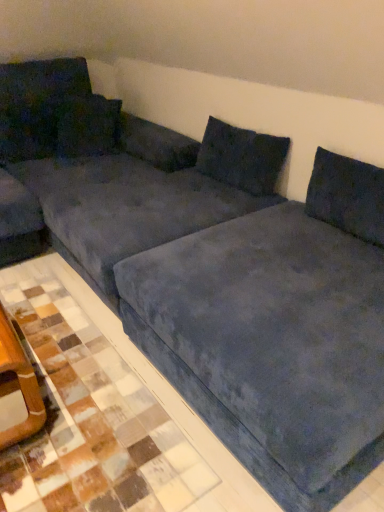
Question: From the image's perspective, would you say blue suede tile at lower right is positioned over velvet dark blue pillow at upper left, which is the second pillow in left-to-right order?

Choices:
 (A) yes
 (B) no

Answer: (B)

Question: From a real-world perspective, is blue suede tile at lower right physically above velvet dark blue pillow at upper left, arranged as the second pillow when viewed from the right?

Choices:
 (A) no
 (B) yes

Answer: (A)

Question: Does blue suede tile at lower right have a greater height compared to velvet dark blue pillow at upper left, arranged as the second pillow when viewed from the right?

Choices:
 (A) yes
 (B) no

Answer: (B)

Question: Is blue suede tile at lower right facing towards velvet dark blue pillow at upper left, arranged as the second pillow when viewed from the right?

Choices:
 (A) no
 (B) yes

Answer: (A)

Question: Does blue suede tile at lower right have a lesser width compared to velvet dark blue pillow at upper left, arranged as the second pillow when viewed from the right?

Choices:
 (A) no
 (B) yes

Answer: (A)

Question: Does blue suede tile at lower right have a greater width compared to velvet dark blue pillow at upper left, arranged as the second pillow when viewed from the right?

Choices:
 (A) no
 (B) yes

Answer: (B)

Question: From a real-world perspective, is velvet dark blue pillow at upper center, positioned as the 1th pillow in right-to-left order, on velvet blue couch at center?

Choices:
 (A) no
 (B) yes

Answer: (B)

Question: From a real-world perspective, is velvet dark blue pillow at upper center, the third pillow when ordered from left to right, under velvet blue couch at center?

Choices:
 (A) no
 (B) yes

Answer: (A)

Question: Does velvet dark blue pillow at upper center, the third pillow when ordered from left to right, have a lesser width compared to velvet blue couch at center?

Choices:
 (A) yes
 (B) no

Answer: (A)

Question: Is velvet dark blue pillow at upper center, positioned as the 1th pillow in right-to-left order, outside velvet blue couch at center?

Choices:
 (A) no
 (B) yes

Answer: (B)

Question: Can you confirm if velvet dark blue pillow at upper center, positioned as the 1th pillow in right-to-left order, is smaller than velvet blue couch at center?

Choices:
 (A) no
 (B) yes

Answer: (B)

Question: Is velvet dark blue pillow at upper center, positioned as the 1th pillow in right-to-left order, next to velvet blue couch at center and touching it?

Choices:
 (A) no
 (B) yes

Answer: (A)

Question: Is velvet dark blue pillow at upper left, arranged as the second pillow when viewed from the right, oriented away from velvet dark blue pillow at upper center, positioned as the 1th pillow in right-to-left order?

Choices:
 (A) no
 (B) yes

Answer: (A)